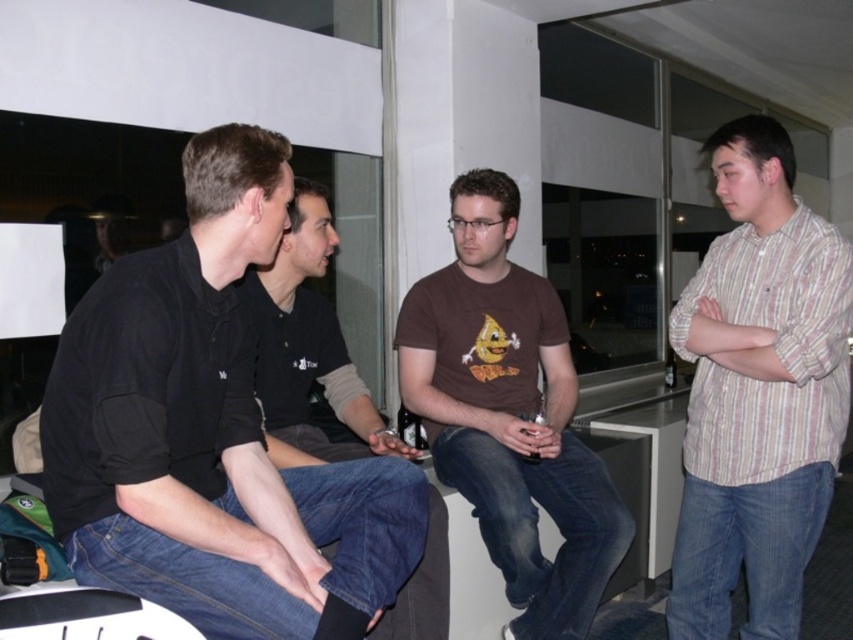
Question: Does black matte shirt at left appear under brown cotton t-shirt at center?

Choices:
 (A) yes
 (B) no

Answer: (B)

Question: Does striped cotton shirt at right appear on the left side of black matte shirt at center?

Choices:
 (A) yes
 (B) no

Answer: (B)

Question: Which point is farther to the camera?

Choices:
 (A) black matte shirt at center
 (B) black matte shirt at left
 (C) striped cotton shirt at right

Answer: (A)

Question: Considering the real-world distances, which object is farthest from the brown cotton t-shirt at center?

Choices:
 (A) black matte shirt at center
 (B) black matte shirt at left
 (C) striped cotton shirt at right

Answer: (B)

Question: Which object is farther from the camera taking this photo?

Choices:
 (A) black matte shirt at left
 (B) brown cotton t-shirt at center
 (C) black matte shirt at center
 (D) striped cotton shirt at right

Answer: (B)

Question: Where is striped cotton shirt at right located in relation to brown cotton t-shirt at center in the image?

Choices:
 (A) right
 (B) left

Answer: (A)